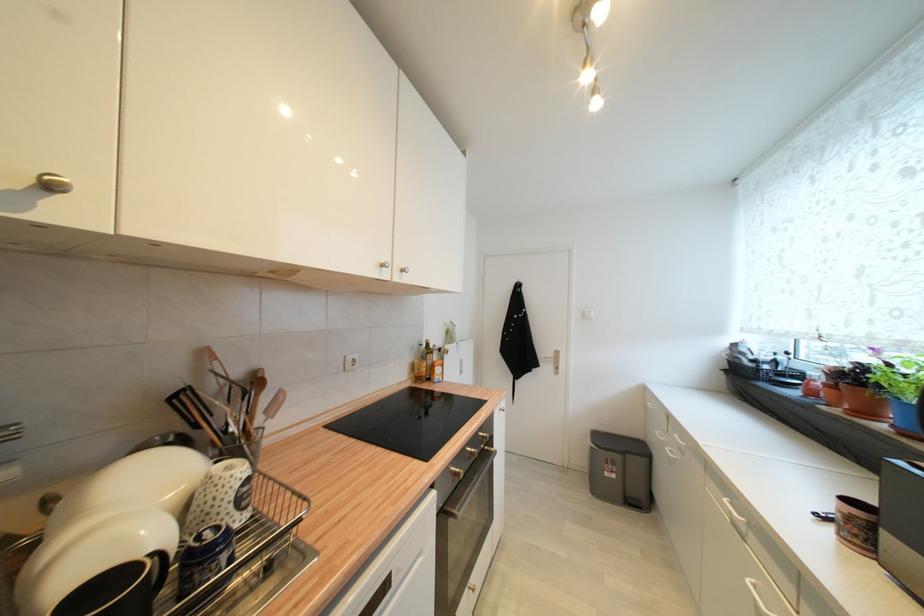
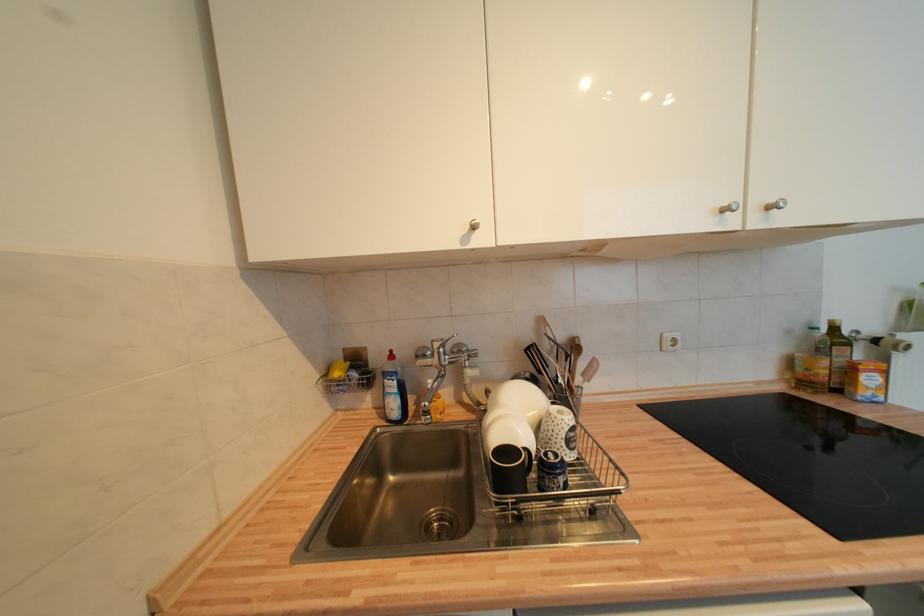
Where in the second image is the point corresponding to pixel 271 414 from the first image?

(588, 377)